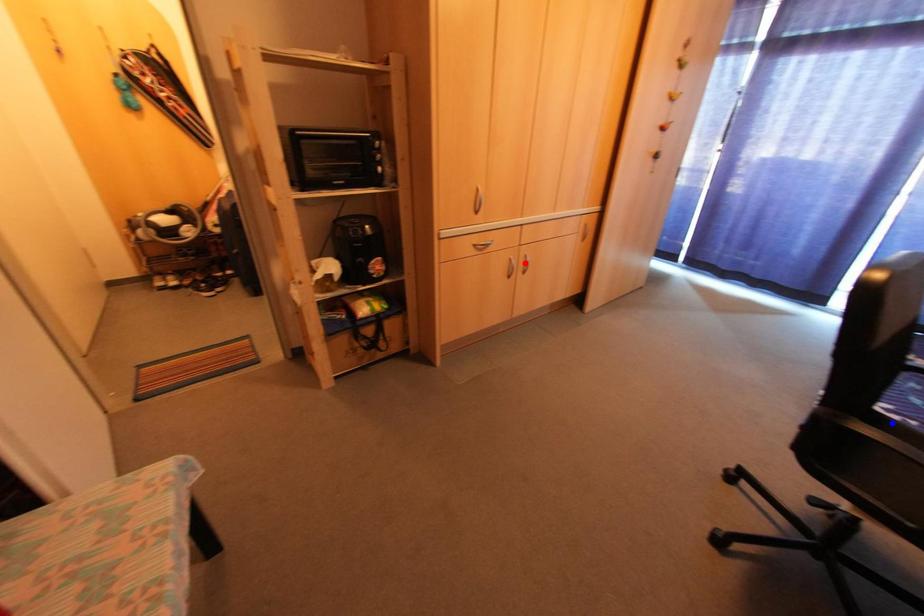
Question: Which of the two points in the image is closer to the camera?

Choices:
 (A) Blue point is closer.
 (B) Red point is closer.

Answer: (A)